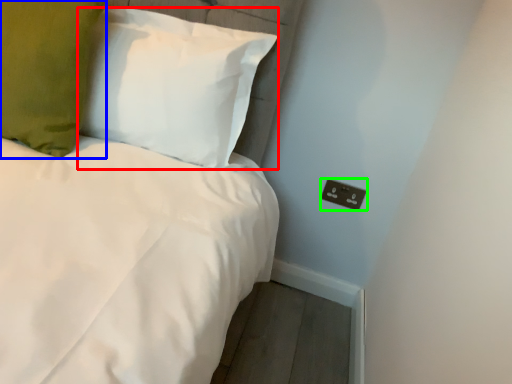
Question: Which object is positioned farthest from pillow (highlighted by a red box)? Select from pillow (highlighted by a blue box) and electric outlet (highlighted by a green box).

Choices:
 (A) pillow
 (B) electric outlet

Answer: (B)